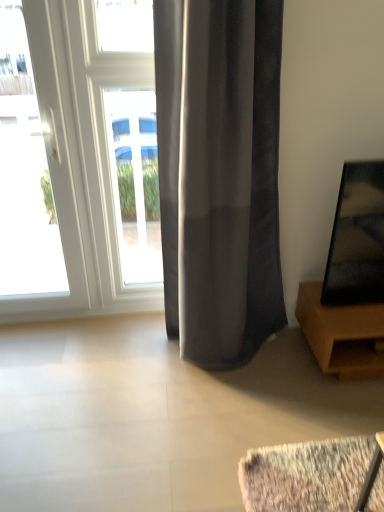
In order to click on free space underneath white glossy door at left (from a real-world perspective) in this screenshot , I will do `click(46, 322)`.